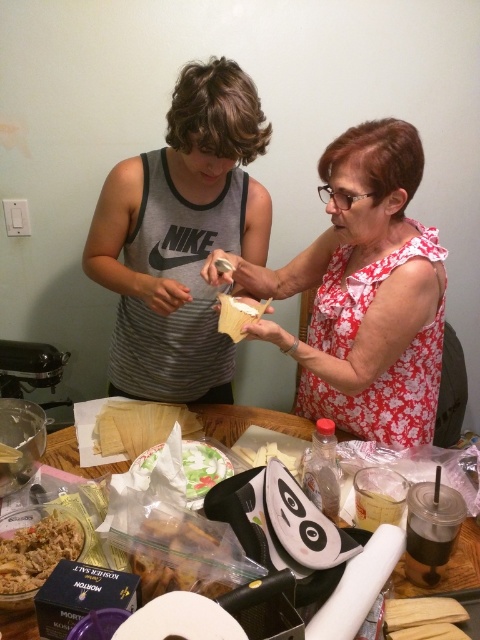
You are standing in the kitchen and see the gray striped tank top at center and the wooden table at center. Which object is closer to the left side of the scene?

The gray striped tank top at center is to the left of the wooden table at center, so it is closer to the left side of the scene.